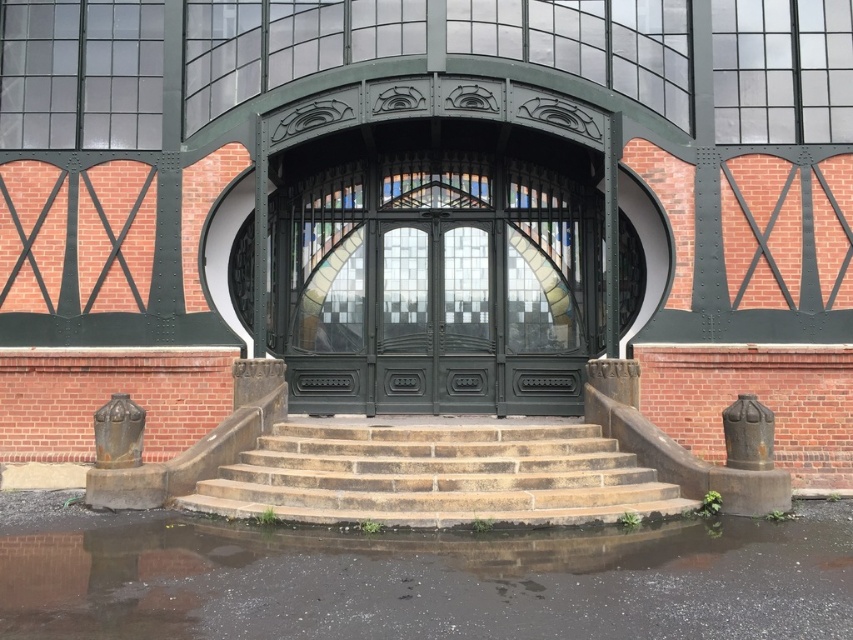
Does green metal/glass doors at center appear on the left side of green matte door at center?

Indeed, green metal/glass doors at center is positioned on the left side of green matte door at center.

Is green metal/glass doors at center positioned before green matte door at center?

Yes, it is in front of green matte door at center.

Is point (309, 257) positioned behind point (416, 346)?

Yes, point (309, 257) is farther from viewer.

At what (x,y) coordinates should I click in order to perform the action: click on green metal/glass doors at center. Please return your answer as a coordinate pair (x, y). Looking at the image, I should click on (434, 285).

Is green metal/glass doors at center positioned in front of brown stone stairs at center?

No.

Between green metal/glass doors at center and brown stone stairs at center, which one has less height?

Standing shorter between the two is brown stone stairs at center.

Is point (447, 291) behind point (299, 461)?

Yes, point (447, 291) is farther from viewer.

Identify the location of green metal/glass doors at center. The image size is (853, 640). (434, 285).

What do you see at coordinates (434, 474) in the screenshot? I see `brown stone stairs at center` at bounding box center [434, 474].

Between point (456, 454) and point (389, 356), which one is positioned behind?

The point (389, 356) is more distant.

Which is in front, point (467, 456) or point (477, 253)?

Positioned in front is point (467, 456).

The image size is (853, 640). What are the coordinates of `brown stone stairs at center` in the screenshot? It's located at (434, 474).